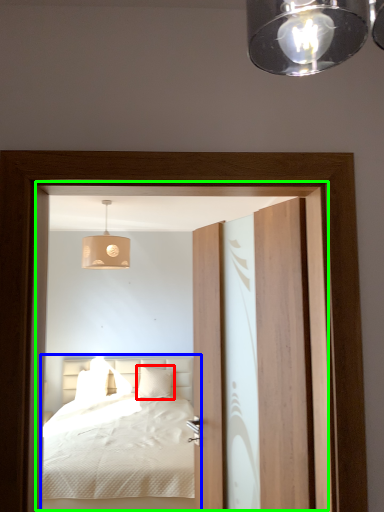
Question: Estimate the real-world distances between objects in this image. Which object is farther from pillow (highlighted by a red box), bed (highlighted by a blue box) or screen door (highlighted by a green box)?

Choices:
 (A) bed
 (B) screen door

Answer: (B)